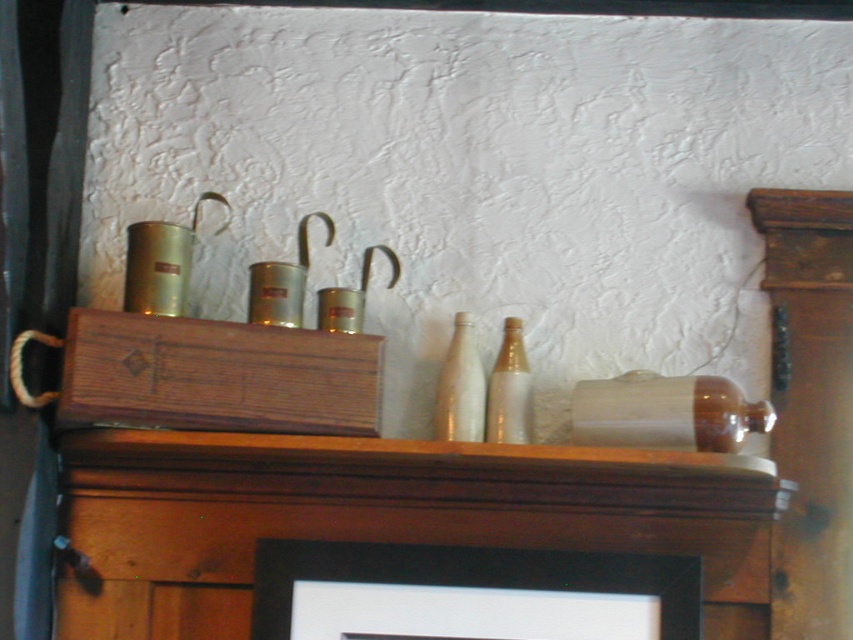
Question: Which object is closer to the camera taking this photo?

Choices:
 (A) transparent glass bottle at center
 (B) white glass bottle at center

Answer: (A)

Question: Based on their relative distances, which object is nearer to the white glass bottle at center?

Choices:
 (A) black matte picture frame at upper center
 (B) wooden at center
 (C) translucent glass bottle at center
 (D) transparent glass bottle at center

Answer: (C)

Question: Does transparent glass bottle at center lie in front of translucent glass bottle at center?

Choices:
 (A) yes
 (B) no

Answer: (A)

Question: Is black matte picture frame at upper center thinner than transparent glass bottle at center?

Choices:
 (A) yes
 (B) no

Answer: (B)

Question: Which of the following is the closest to the observer?

Choices:
 (A) (477, 400)
 (B) (341, 612)
 (C) (654, 426)

Answer: (C)

Question: Is wooden at center closer to the viewer compared to translucent glass bottle at center?

Choices:
 (A) yes
 (B) no

Answer: (A)